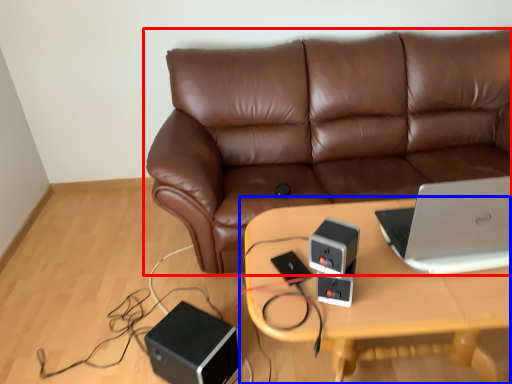
Question: Among these objects, which one is nearest to the camera, studio couch (highlighted by a red box) or table (highlighted by a blue box)?

Choices:
 (A) studio couch
 (B) table

Answer: (B)